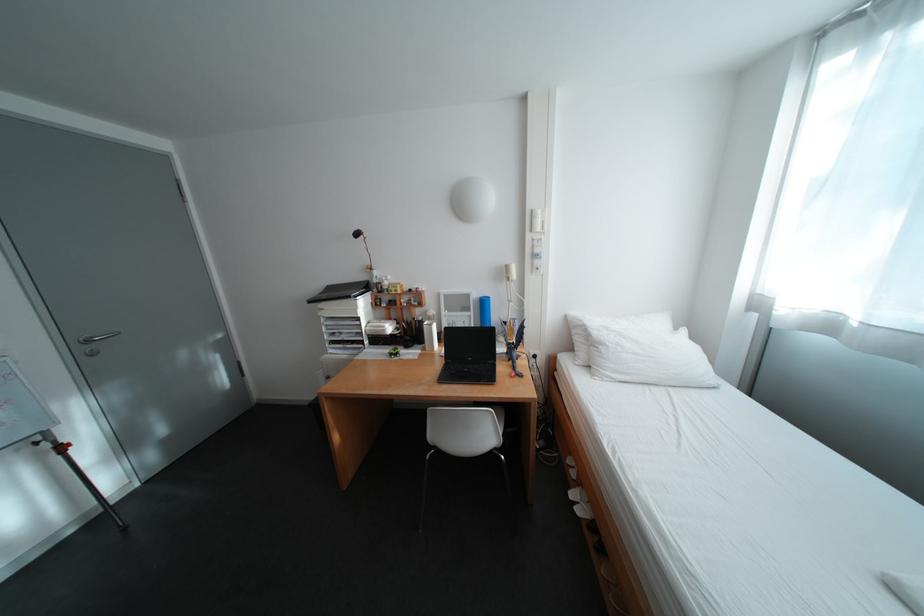
Which object does [484,310] point to?

It corresponds to the blue water bottle in the image.